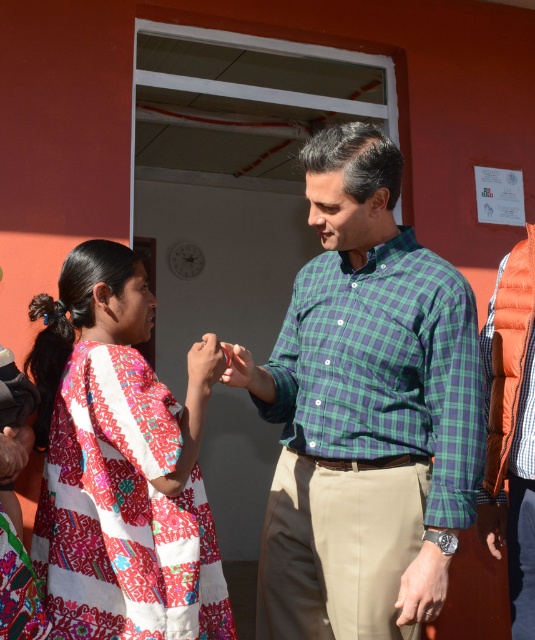
Between embroidered cotton dress at center and smooth skin hand at center, which one has less height?

smooth skin hand at center

Who is higher up, embroidered cotton dress at center or smooth skin hand at center?

Positioned higher is smooth skin hand at center.

Locate an element on the screen. embroidered cotton dress at center is located at coordinates (118, 467).

I want to click on embroidered cotton dress at center, so click(118, 467).

Can you confirm if green plaid shirt at center is positioned above smooth skin hand at center?

No.

Can you confirm if green plaid shirt at center is positioned to the left of smooth skin hand at center?

In fact, green plaid shirt at center is to the right of smooth skin hand at center.

Does point (317, 264) lie behind point (221, 371)?

Yes, point (317, 264) is farther from viewer.

You are a GUI agent. You are given a task and a screenshot of the screen. Output one action in this format:
    pyautogui.click(x=<x>, y=<y>)
    Task: Click on the green plaid shirt at center
    The height and width of the screenshot is (640, 535).
    Given the screenshot: What is the action you would take?
    pyautogui.click(x=385, y=369)

Is embroidered cotton dress at center below green plaid shirt at center?

Correct, embroidered cotton dress at center is located below green plaid shirt at center.

Can you confirm if embroidered cotton dress at center is positioned to the left of green plaid shirt at center?

Indeed, embroidered cotton dress at center is positioned on the left side of green plaid shirt at center.

Does point (148, 419) come in front of point (324, 305)?

Yes, point (148, 419) is closer to viewer.

Identify the location of embroidered cotton dress at center. (118, 467).